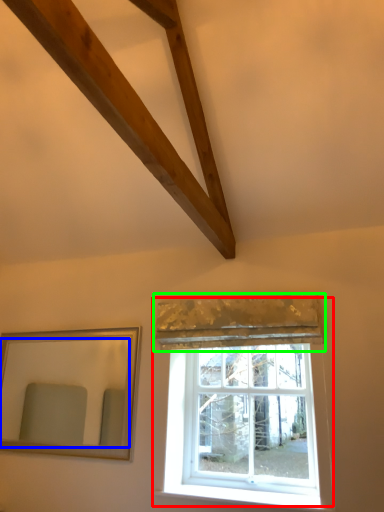
Question: Which is nearer to the window (highlighted by a red box)? mirror (highlighted by a blue box) or curtain (highlighted by a green box).

Choices:
 (A) mirror
 (B) curtain

Answer: (B)